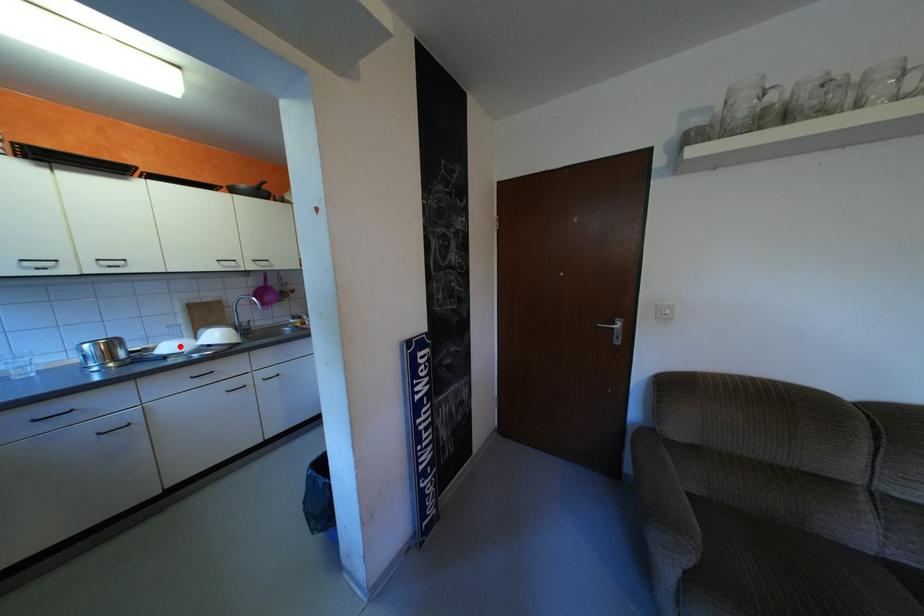
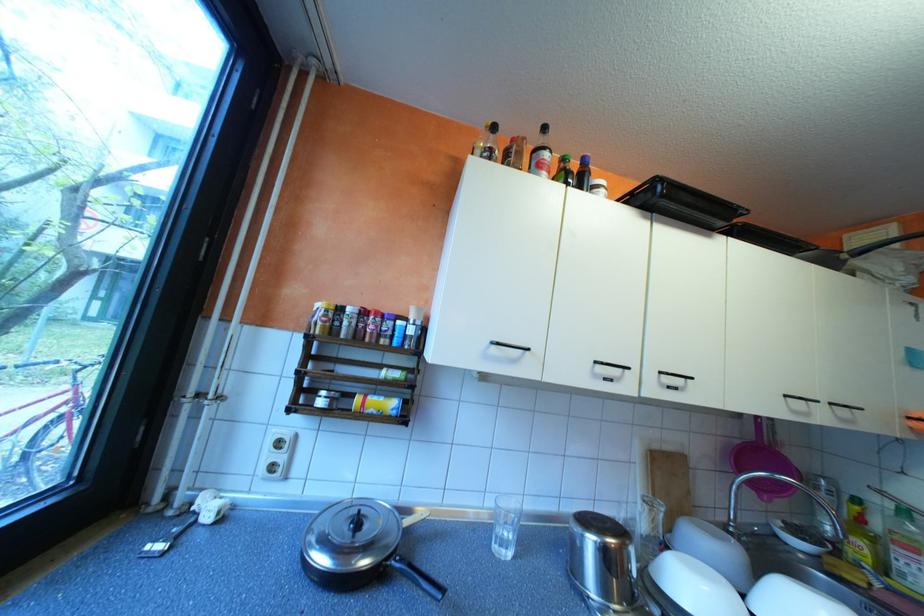
In the second image, find the point that corresponds to the highlighted location in the first image.

(709, 592)